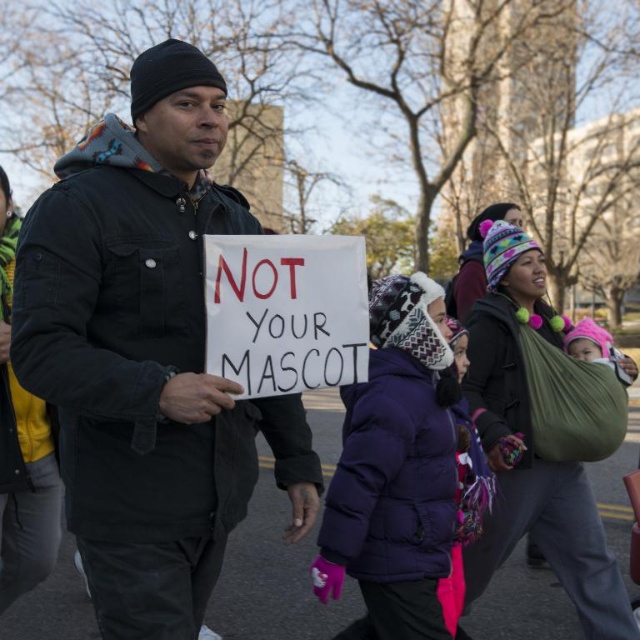
Question: Which object appears closest to the camera in this image?

Choices:
 (A) purple puffy coat at center
 (B) matte black jacket at center

Answer: (B)

Question: Is matte black jacket at center below purple puffy coat at center?

Choices:
 (A) no
 (B) yes

Answer: (A)

Question: Does matte black jacket at center appear on the right side of purple puffy coat at center?

Choices:
 (A) no
 (B) yes

Answer: (A)

Question: Does matte black jacket at center have a lesser width compared to purple puffy coat at center?

Choices:
 (A) no
 (B) yes

Answer: (A)